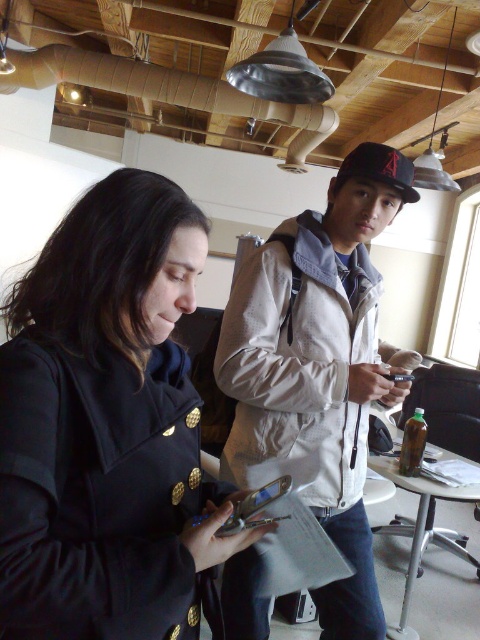
Between point (168, 291) and point (252, 493), which one is positioned behind?

The point (252, 493) is behind.

Is point (36, 444) positioned before point (262, 497)?

That is True.

In order to click on black matte coat at center in this screenshot , I will do `click(107, 426)`.

Is the position of black matte coat at center less distant than that of light beige jacket at center?

Yes, it is.

Does point (119, 586) lie behind point (282, 248)?

No, it is in front of (282, 248).

You are a GUI agent. You are given a task and a screenshot of the screen. Output one action in this format:
    pyautogui.click(x=<x>, y=<y>)
    Task: Click on the black matte coat at center
    The image size is (480, 640).
    Given the screenshot: What is the action you would take?
    pyautogui.click(x=107, y=426)

In order to click on black matte coat at center in this screenshot , I will do `click(107, 426)`.

Describe the element at coordinates (319, 364) in the screenshot. The image size is (480, 640). I see `light beige jacket at center` at that location.

Does light beige jacket at center appear on the right side of silver metallic phone at center?

Indeed, light beige jacket at center is positioned on the right side of silver metallic phone at center.

Identify the location of light beige jacket at center. (319, 364).